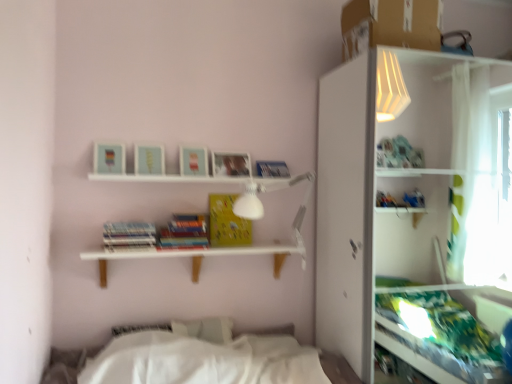
Question: Which direction should I rotate to look at yellow matte paper at center, arranged as the 1th paperback book when viewed from the right?

Choices:
 (A) left
 (B) right

Answer: (A)

Question: Is hardcover book at center, which is counted as the second paperback book, starting from the right, thinner than hardcover books at center, the 3th paperback book in the right-to-left sequence?

Choices:
 (A) no
 (B) yes

Answer: (B)

Question: Is hardcover book at center, which is counted as the second paperback book, starting from the right, smaller than hardcover books at center, the 3th paperback book in the right-to-left sequence?

Choices:
 (A) no
 (B) yes

Answer: (B)

Question: Does hardcover book at center, which is counted as the second paperback book, starting from the right, have a lesser height compared to hardcover books at center, the 3th paperback book in the right-to-left sequence?

Choices:
 (A) no
 (B) yes

Answer: (B)

Question: Does hardcover book at center, arranged as the 2th paperback book when viewed from the left, touch hardcover books at center, positioned as the 1th paperback book in left-to-right order?

Choices:
 (A) no
 (B) yes

Answer: (A)

Question: From the image's perspective, is hardcover book at center, which is counted as the second paperback book, starting from the right, located beneath hardcover books at center, positioned as the 1th paperback book in left-to-right order?

Choices:
 (A) no
 (B) yes

Answer: (B)

Question: From a real-world perspective, is hardcover book at center, which is counted as the second paperback book, starting from the right, located beneath hardcover books at center, positioned as the 1th paperback book in left-to-right order?

Choices:
 (A) no
 (B) yes

Answer: (B)

Question: Are yellow matte paper at center, arranged as the 1th paperback book when viewed from the right, and white matte shelf at center far apart?

Choices:
 (A) no
 (B) yes

Answer: (A)

Question: From the image's perspective, is yellow matte paper at center, arranged as the third paperback book when viewed from the left, below white matte shelf at center?

Choices:
 (A) no
 (B) yes

Answer: (A)

Question: Is yellow matte paper at center, arranged as the third paperback book when viewed from the left, oriented away from white matte shelf at center?

Choices:
 (A) yes
 (B) no

Answer: (B)

Question: Does yellow matte paper at center, arranged as the third paperback book when viewed from the left, turn towards white matte shelf at center?

Choices:
 (A) yes
 (B) no

Answer: (B)

Question: Does yellow matte paper at center, arranged as the 1th paperback book when viewed from the right, have a greater width compared to white matte shelf at center?

Choices:
 (A) no
 (B) yes

Answer: (A)

Question: Is yellow matte paper at center, arranged as the 1th paperback book when viewed from the right, behind white matte shelf at center?

Choices:
 (A) yes
 (B) no

Answer: (A)

Question: Is white glossy shelf at upper right aimed at hardcover book at center, arranged as the 2th paperback book when viewed from the left?

Choices:
 (A) no
 (B) yes

Answer: (A)